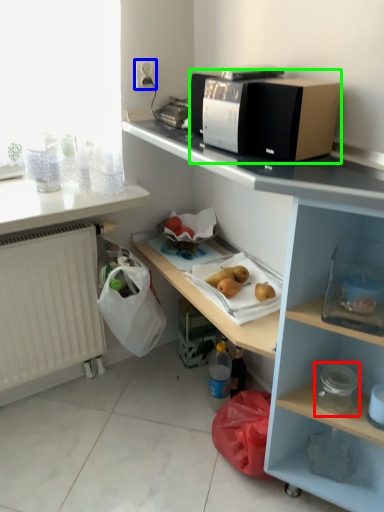
Question: Estimate the real-world distances between objects in this image. Which object is closer to appliance (highlighted by a red box), electric outlet (highlighted by a blue box) or home appliance (highlighted by a green box)?

Choices:
 (A) electric outlet
 (B) home appliance

Answer: (B)